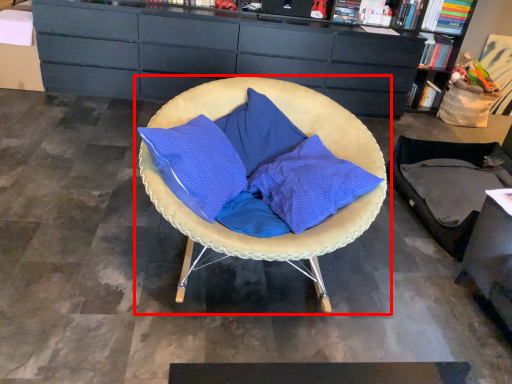
Question: In this image, where is chair (annotated by the red box) located relative to cabinetry?

Choices:
 (A) right
 (B) left

Answer: (B)